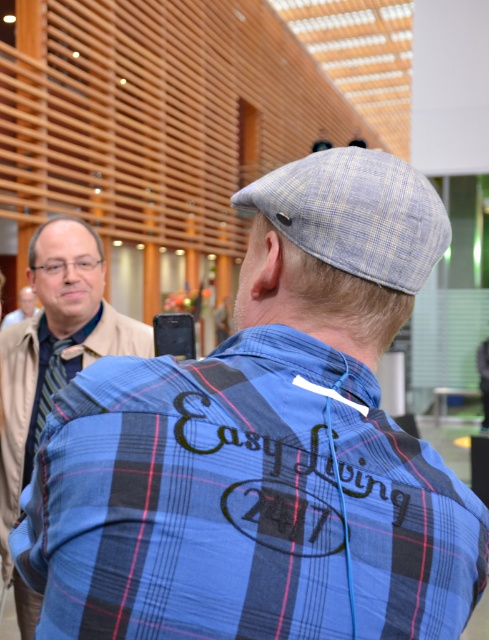
Question: Which of these objects is positioned closest to the blue plaid shirt at center?

Choices:
 (A) matte black shirt at upper left
 (B) matte black jacket at left

Answer: (A)

Question: Can you confirm if blue plaid shirt at center is positioned below striped fabric tie at left?

Choices:
 (A) yes
 (B) no

Answer: (B)

Question: Is blue plaid shirt at center closer to camera compared to matte black jacket at left?

Choices:
 (A) yes
 (B) no

Answer: (A)

Question: Which is farther from the matte black shirt at upper left?

Choices:
 (A) blue plaid shirt at center
 (B) striped fabric tie at left

Answer: (A)

Question: Which point is closer to the camera taking this photo?

Choices:
 (A) (3, 317)
 (B) (69, 358)
 (C) (326, 406)
 (D) (6, 477)

Answer: (C)

Question: Does blue plaid shirt at center have a smaller size compared to matte black shirt at upper left?

Choices:
 (A) yes
 (B) no

Answer: (A)